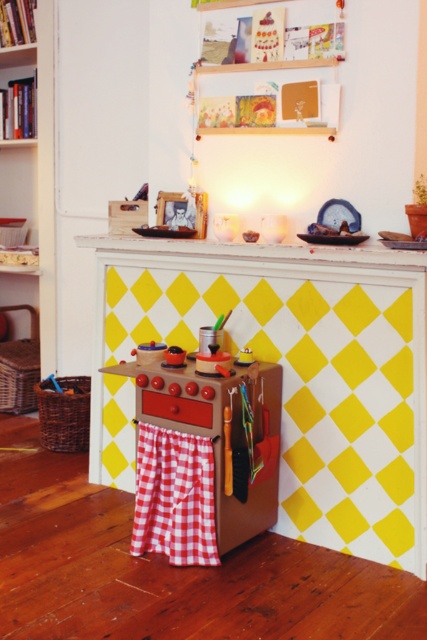
You are organizing a child safety inspection in this playroom. The wooden bookshelf at left and the red checkered fabric at lower center are both in the room. Which object takes up more space in the room?

The wooden bookshelf at left is bigger than the red checkered fabric at lower center, so it takes up more space in the room.

You are a child trying to reach the wooden toy stove at center and the red checkered fabric at lower center. Which one can you touch first without moving your position?

The wooden toy stove at center is closer to the viewer than the red checkered fabric at lower center, so you can touch it first without moving.

You are setting up a playroom and need to place a large toy box that requires 1.2 meters of space. You see the wooden bookshelf at left and the wooden toy stove at center. Which object can accommodate the toy box next to it without overcrowding the area?

The wooden bookshelf at left has a larger size compared to the wooden toy stove at center, so it can accommodate the large toy box next to it without overcrowding the area.